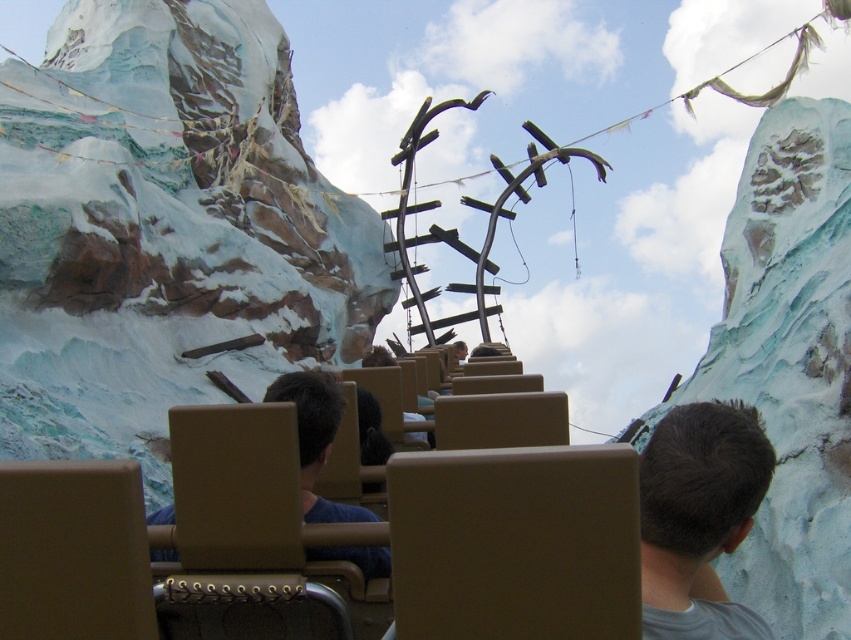
You are a photographer taking a picture of the passengers on the roller coaster. You notice the dark brown hair at center and the blue fabric shirt at center. Which object should you focus on to ensure the other is in the background?

→ You should focus on the dark brown hair at center because it is in front of the blue fabric shirt at center, so if you focus on the dark brown hair at center, the blue fabric shirt at center will naturally be in the background.

In the scene shown: You are a photographer trying to capture a clear shot of the dark brown hair at center and the brown leather jacket at center. Since you want to focus on the person, which object should you adjust your camera to focus on first?

The dark brown hair at center is positioned under brown leather jacket at center, so you should focus on the brown leather jacket at center first to ensure the entire person is in frame.

From the picture: You are a photographer taking a picture of the passengers on the roller coaster. You notice the dark brown hair at center and the blue fabric shirt at center. Which object should you focus on to capture the one that is taller?

The dark brown hair at center is much taller than the blue fabric shirt at center, so you should focus on the dark brown hair at center to capture the taller object.